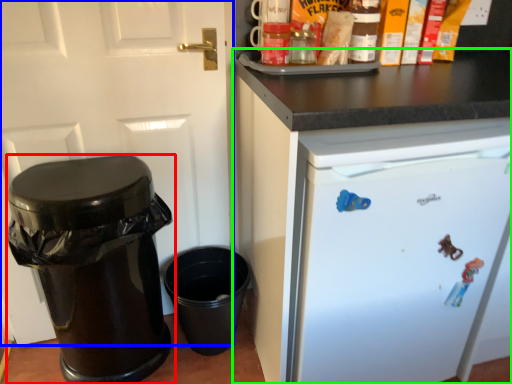
Question: Which object is the closest to the waste container (highlighted by a red box)? Choose among these: door (highlighted by a blue box) or cabinetry (highlighted by a green box).

Choices:
 (A) door
 (B) cabinetry

Answer: (A)